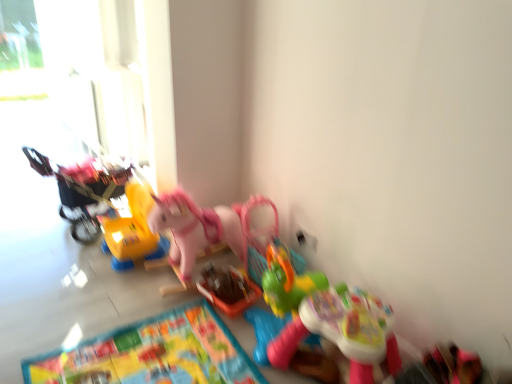
Find the location of a particular element. The image size is (512, 384). vacant region to the left of plastic basket at center, arranged as the fifth toy when viewed from the left is located at coordinates (174, 295).